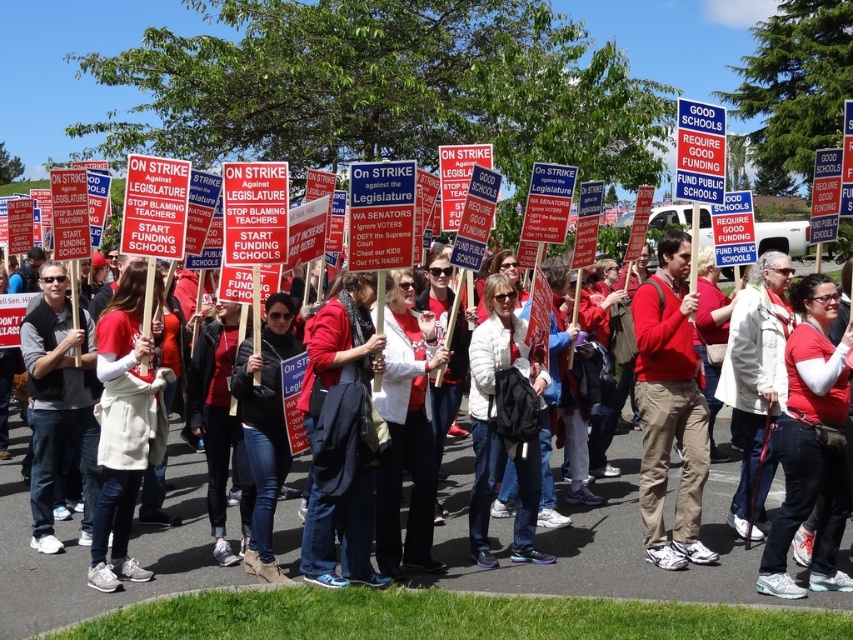
Question: Can you confirm if matte red shirt at center is thinner than gray vest at center?

Choices:
 (A) yes
 (B) no

Answer: (A)

Question: Which point appears closest to the camera in this image?

Choices:
 (A) (49, 588)
 (B) (532, 513)
 (C) (144, 321)
 (D) (657, 257)

Answer: (A)

Question: Is matte red shirt at center positioned before matte red sweater at center?

Choices:
 (A) yes
 (B) no

Answer: (B)

Question: Among these points, which one is farthest from the camera?

Choices:
 (A) (664, 532)
 (B) (242, 573)
 (C) (106, 369)

Answer: (A)

Question: Is matte red jacket at center thinner than white fleece jacket at center?

Choices:
 (A) yes
 (B) no

Answer: (B)

Question: Which of these objects is positioned farthest from the matte red shirt at center?

Choices:
 (A) matte red jacket at center
 (B) denim jeans at center
 (C) white matte jacket at center
 (D) gray vest at center

Answer: (D)